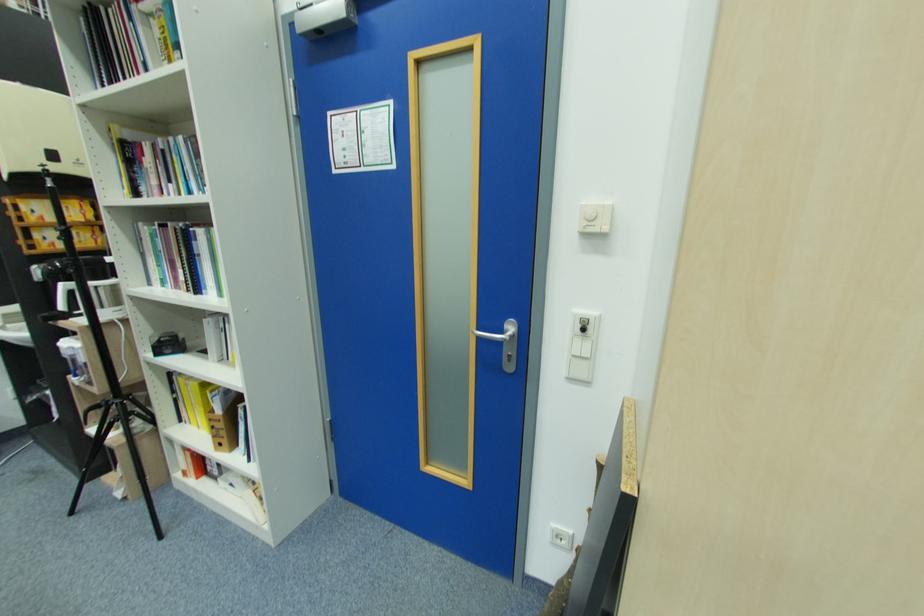
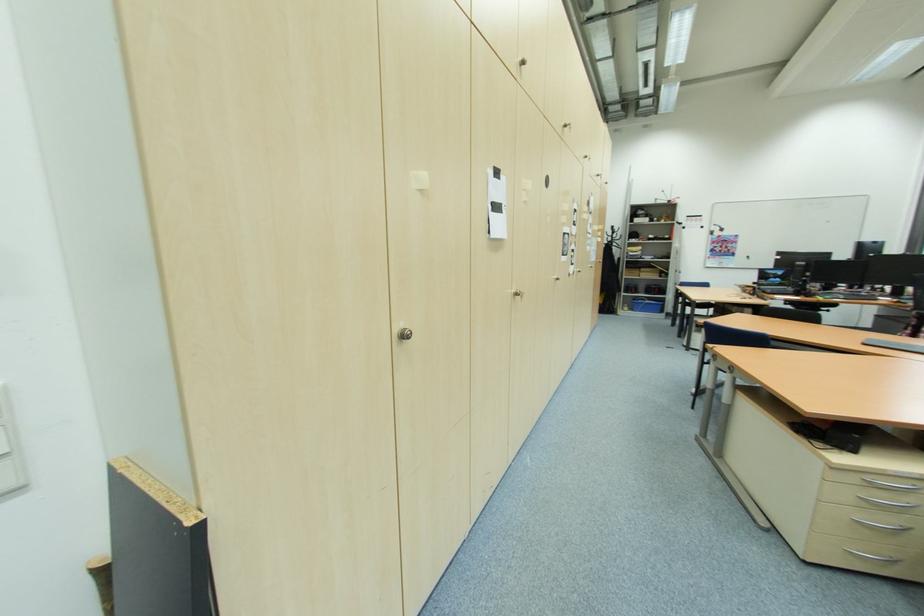
Question: Based on the continuous images, in which direction is the camera rotating? Reply with the corresponding letter.

Choices:
 (A) Left
 (B) Right
 (C) Up
 (D) Down

Answer: (B)